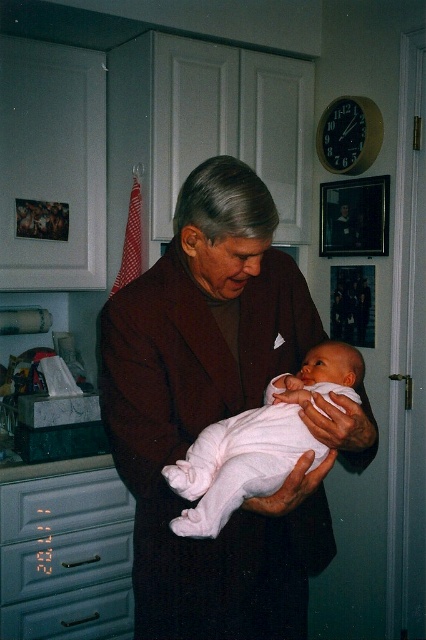
Which of these two, dark brown wool coat at center or white soft fabric newborn at center, stands shorter?

With less height is white soft fabric newborn at center.

Is the position of dark brown wool coat at center less distant than that of white soft fabric newborn at center?

That is False.

The image size is (426, 640). Describe the element at coordinates (219, 413) in the screenshot. I see `dark brown wool coat at center` at that location.

The image size is (426, 640). Find the location of `dark brown wool coat at center`. dark brown wool coat at center is located at coordinates (219, 413).